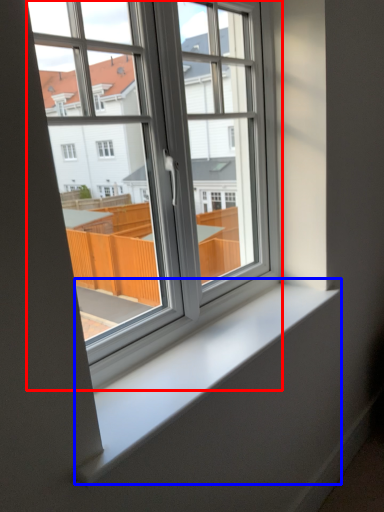
Question: Which object is closer to the camera taking this photo, window (highlighted by a red box) or window sill (highlighted by a blue box)?

Choices:
 (A) window
 (B) window sill

Answer: (A)